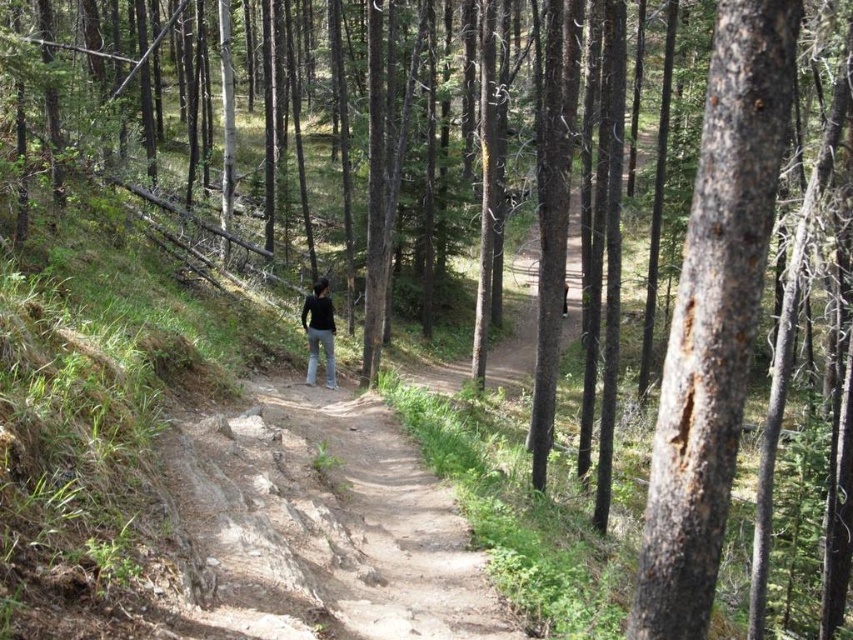
Consider the image. Is brown rough bark tree at center right taller than dark gray jeans at center?

Incorrect, brown rough bark tree at center right's height is not larger of dark gray jeans at center's.

Can you confirm if brown rough bark tree at center right is wider than dark gray jeans at center?

No, brown rough bark tree at center right is not wider than dark gray jeans at center.

Which is in front, point (766, 157) or point (328, 314)?

Point (766, 157) is in front.

Locate an element on the screen. brown rough bark tree at center right is located at coordinates (714, 317).